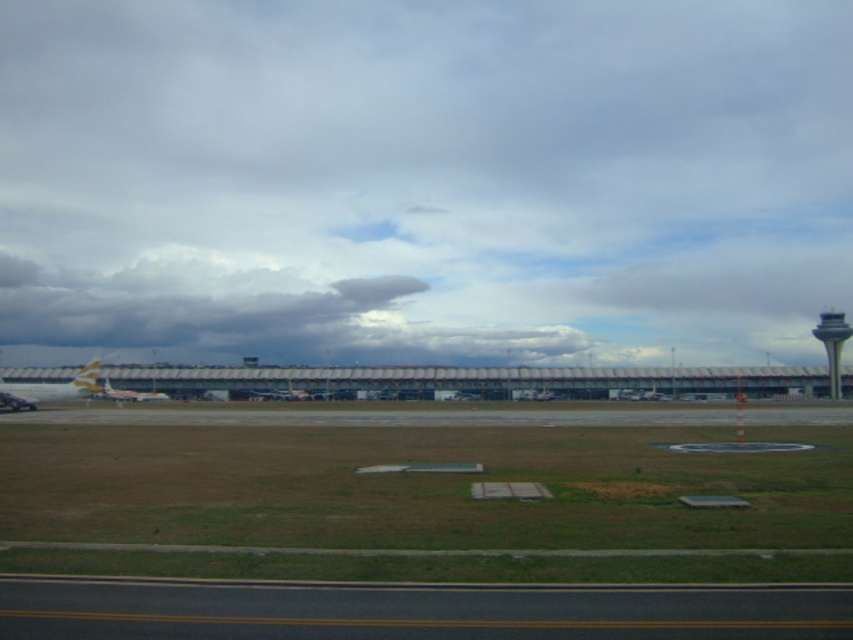
Between point (821, 600) and point (126, 266), which one is positioned in front?

Positioned in front is point (821, 600).

Where is `black asphalt runway at lower center`? The width and height of the screenshot is (853, 640). black asphalt runway at lower center is located at coordinates (412, 611).

How much distance is there between black asphalt runway at lower center and gray concrete control tower at right?

black asphalt runway at lower center is 66.48 meters away from gray concrete control tower at right.

Is point (752, 620) positioned in front of point (820, 337)?

That is True.

Which is behind, point (131, 612) or point (833, 381)?

The point (833, 381) is behind.

The height and width of the screenshot is (640, 853). In order to click on black asphalt runway at lower center in this screenshot , I will do `click(412, 611)`.

Is gray concrete control tower at right in front of metallic silver airplane at center?

No, it is behind metallic silver airplane at center.

Is point (836, 348) positioned behind point (88, 378)?

That is True.

Does point (817, 332) lie in front of point (120, 394)?

No, it is not.

This screenshot has width=853, height=640. Identify the location of gray concrete control tower at right. (833, 346).